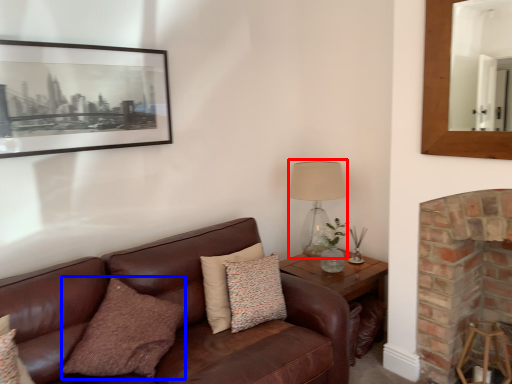
Question: Which object appears closest to the camera in this image, table lamp (highlighted by a red box) or pillow (highlighted by a blue box)?

Choices:
 (A) table lamp
 (B) pillow

Answer: (B)